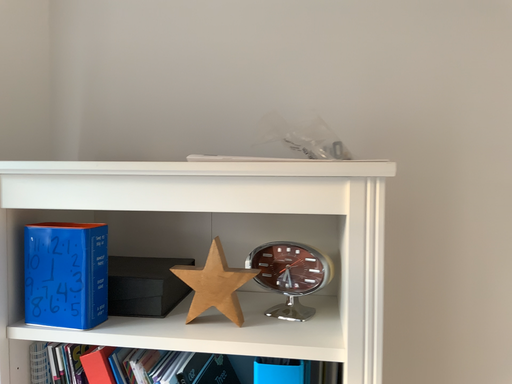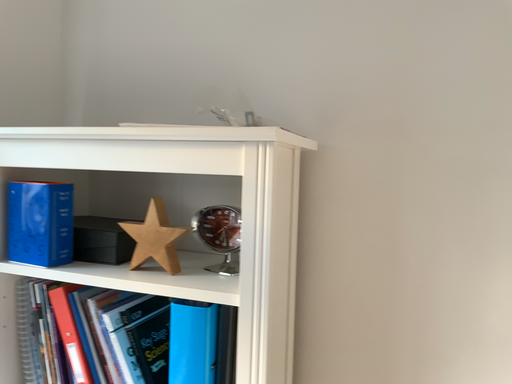
Question: Which way did the camera rotate in the video?

Choices:
 (A) rotated right
 (B) rotated left

Answer: (B)